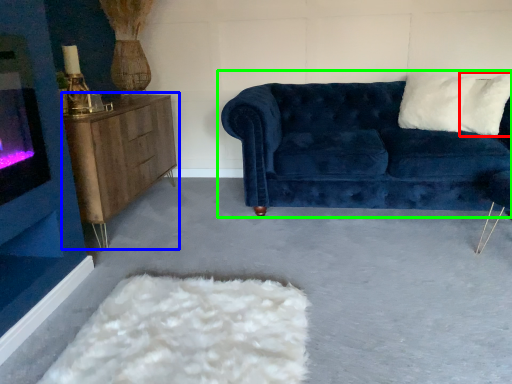
Question: Based on their relative distances, which object is nearer to pillow (highlighted by a red box)? Choose from table (highlighted by a blue box) and studio couch (highlighted by a green box).

Choices:
 (A) table
 (B) studio couch

Answer: (B)